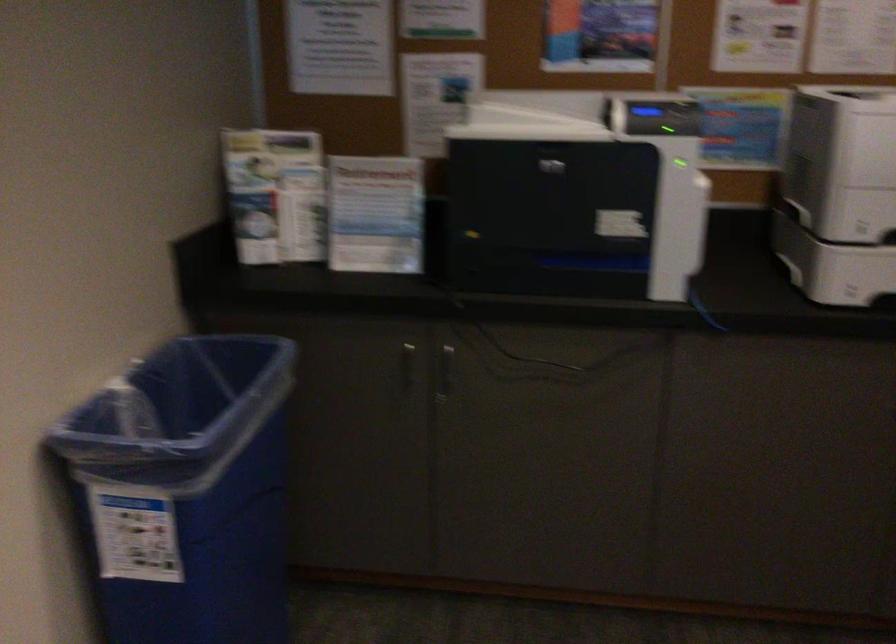
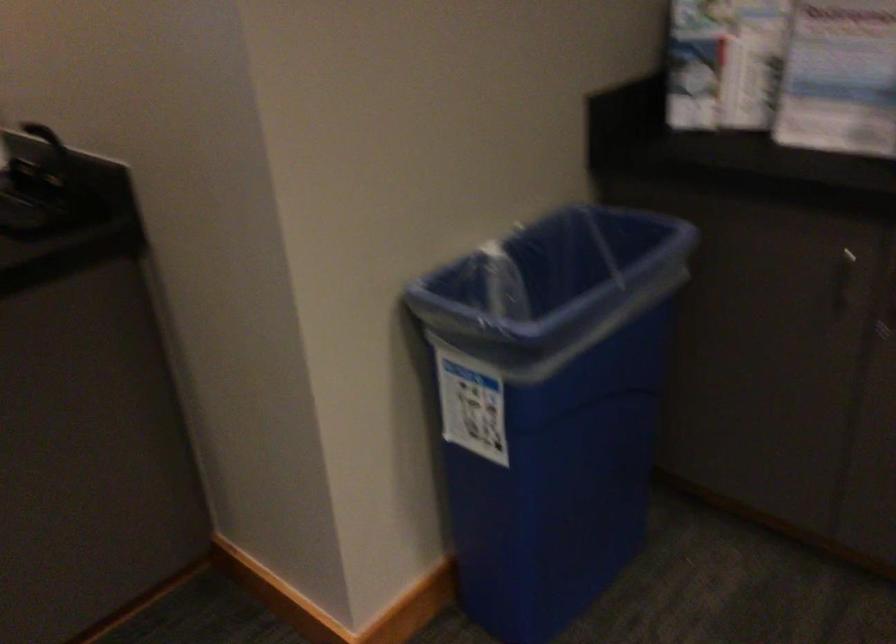
Locate, in the second image, the point that corresponds to (181,408) in the first image.

(556, 281)